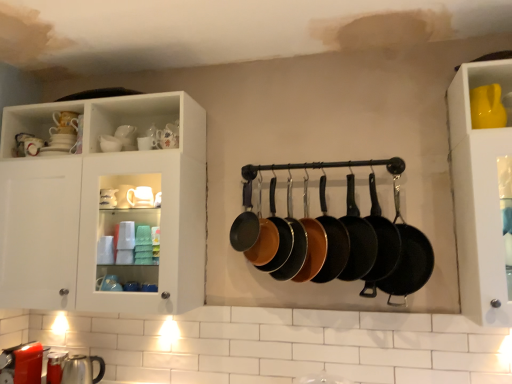
Question: Does matte black frying pan at center, which is the third frying pan in left-to-right order, appear on the right side of shiny black frying pan at center, marked as the 9th frying pan in a right-to-left arrangement?

Choices:
 (A) yes
 (B) no

Answer: (A)

Question: Would you say matte black frying pan at center, which is the third frying pan in left-to-right order, contains shiny black frying pan at center, the first frying pan positioned from the left?

Choices:
 (A) yes
 (B) no

Answer: (B)

Question: Would you say matte black frying pan at center, which is the third frying pan in left-to-right order, is outside shiny black frying pan at center, the first frying pan positioned from the left?

Choices:
 (A) no
 (B) yes

Answer: (B)

Question: Is matte black frying pan at center, which is the third frying pan in left-to-right order, positioned in front of shiny black frying pan at center, the first frying pan positioned from the left?

Choices:
 (A) no
 (B) yes

Answer: (B)

Question: Is matte black frying pan at center, the seventh frying pan viewed from the right, oriented towards shiny black frying pan at center, marked as the 9th frying pan in a right-to-left arrangement?

Choices:
 (A) no
 (B) yes

Answer: (A)

Question: Considering the positions of matte black frying pan at center, the 6th frying pan viewed from the right, and metallic silver kettle at lower left, the third tableware when ordered from back to front, in the image, is matte black frying pan at center, the 6th frying pan viewed from the right, wider or thinner than metallic silver kettle at lower left, the third tableware when ordered from back to front,?

Choices:
 (A) wide
 (B) thin

Answer: (B)

Question: Based on their positions, is matte black frying pan at center, which is the fourth frying pan in left-to-right order, located to the left or right of metallic silver kettle at lower left, positioned as the second tableware in front-to-back order?

Choices:
 (A) right
 (B) left

Answer: (A)

Question: Based on their sizes in the image, would you say matte black frying pan at center, the 6th frying pan viewed from the right, is bigger or smaller than metallic silver kettle at lower left, which appears as the 1th tableware when viewed from the left?

Choices:
 (A) big
 (B) small

Answer: (A)

Question: From a real-world perspective, is matte black frying pan at center, the 6th frying pan viewed from the right, physically located above or below metallic silver kettle at lower left, the fourth tableware when ordered from right to left?

Choices:
 (A) below
 (B) above

Answer: (B)

Question: In terms of size, does matte brown frying pan at center, which is the second frying pan from left to right, appear bigger or smaller than shiny black frying pan at center, the first frying pan positioned from the left?

Choices:
 (A) big
 (B) small

Answer: (B)

Question: Considering their positions, is matte brown frying pan at center, which is the second frying pan from left to right, located in front of or behind shiny black frying pan at center, marked as the 9th frying pan in a right-to-left arrangement?

Choices:
 (A) front
 (B) behind

Answer: (A)

Question: From the image's perspective, is matte brown frying pan at center, the eighth frying pan from the right, above or below shiny black frying pan at center, marked as the 9th frying pan in a right-to-left arrangement?

Choices:
 (A) above
 (B) below

Answer: (B)

Question: In terms of width, does matte brown frying pan at center, which is the second frying pan from left to right, look wider or thinner when compared to shiny black frying pan at center, marked as the 9th frying pan in a right-to-left arrangement?

Choices:
 (A) thin
 (B) wide

Answer: (A)

Question: Relative to black cast iron frying pan at center, placed as the ninth frying pan when sorted from left to right, is matte ceramic cups at upper center, the 3th tableware in the front-to-back sequence, in front or behind?

Choices:
 (A) front
 (B) behind

Answer: (B)

Question: Looking at the image, does matte ceramic cups at upper center, arranged as the 3th tableware when viewed from the left, seem bigger or smaller compared to black cast iron frying pan at center, placed as the ninth frying pan when sorted from left to right?

Choices:
 (A) big
 (B) small

Answer: (B)